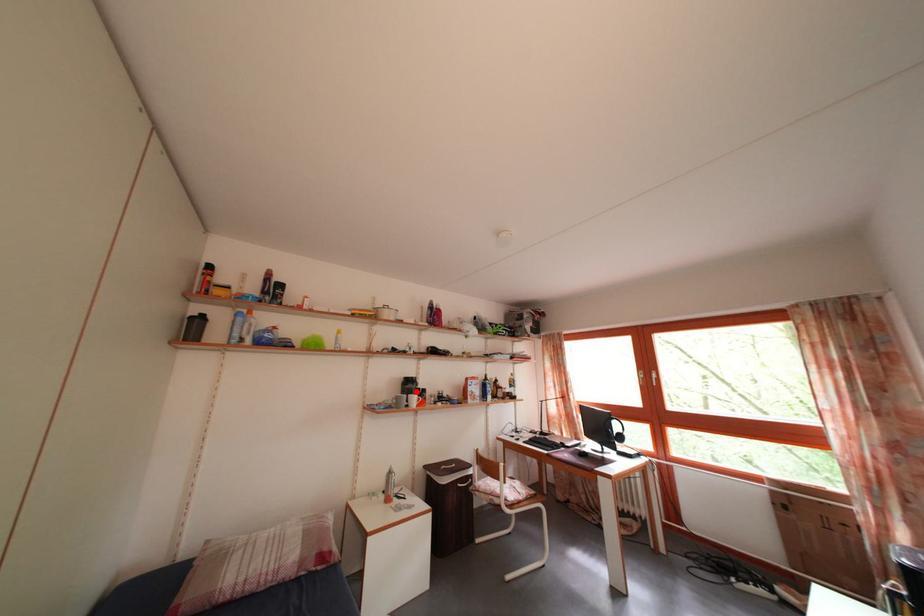
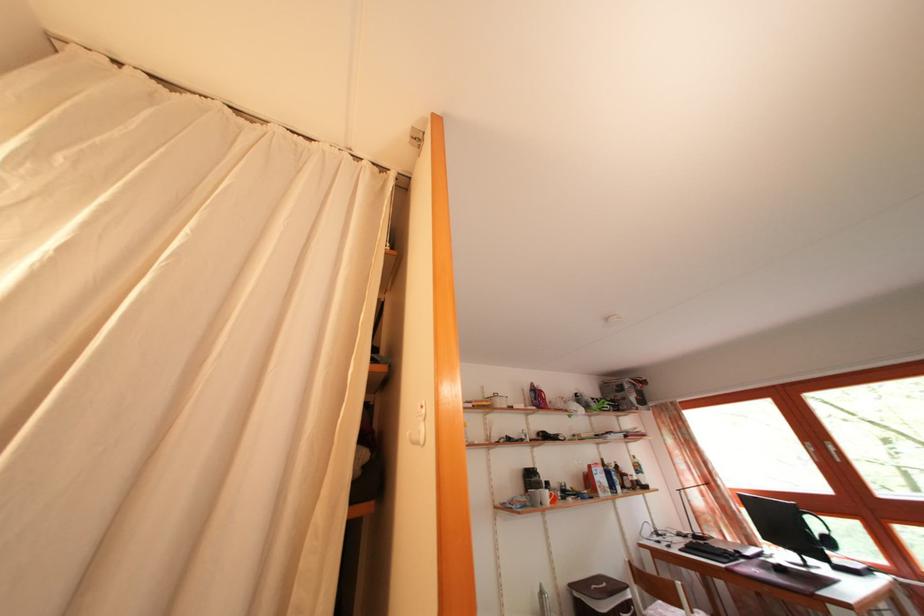
In the second image, find the point that corresponds to the highlighted location in the first image.

(538, 484)